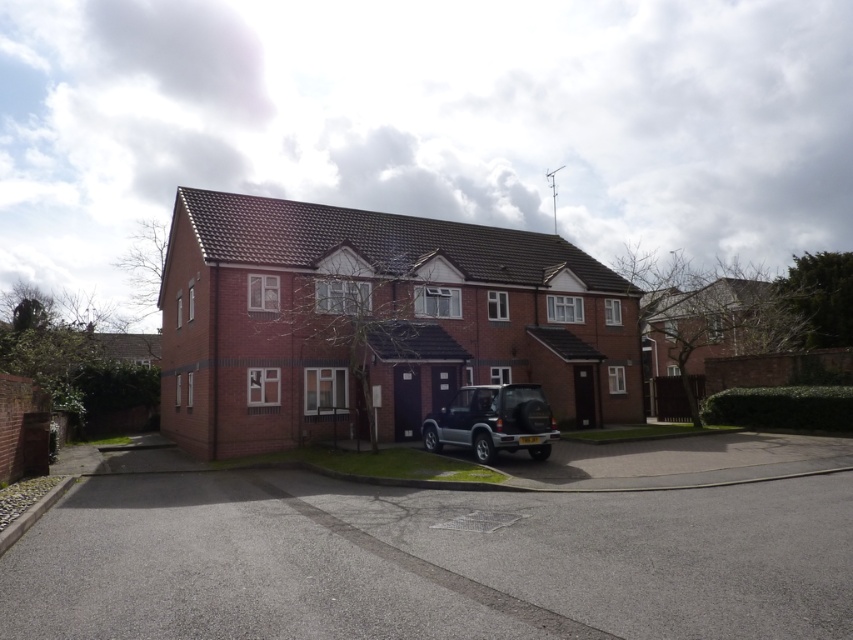
You are standing at the entrance of the brick house at center. Which direction should you face to see the driveway leading to the garage where the dark SUV is parked?

The brick house at center is located at point (x=375, y=321), so you should face the direction of the driveway leading to the garage where the dark SUV is parked.